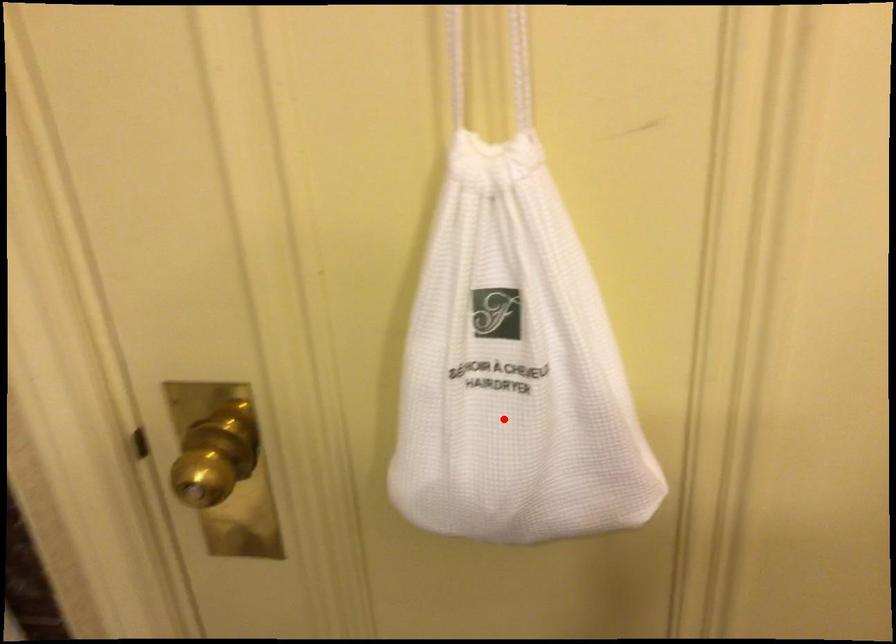
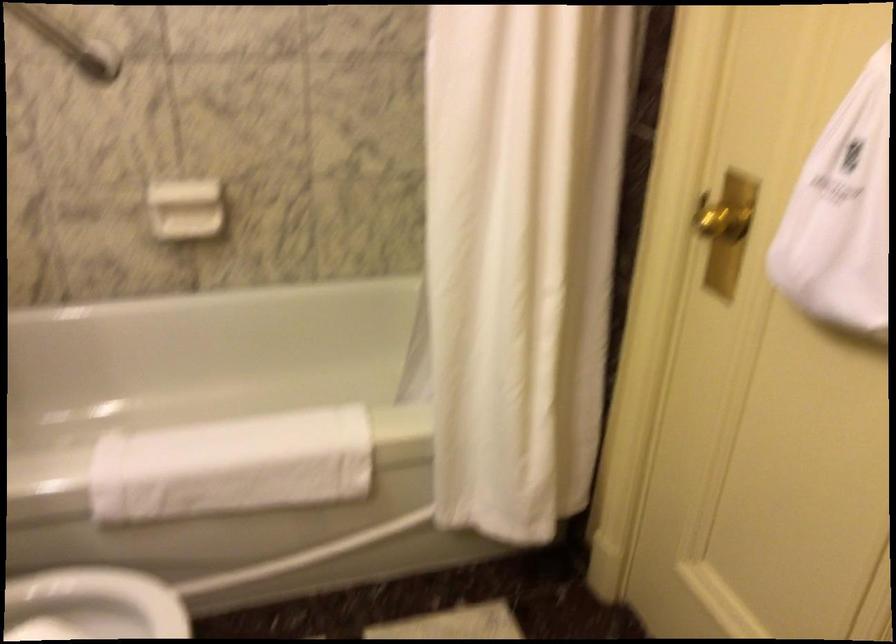
Find the pixel in the second image that matches the highlighted location in the first image.

(841, 214)